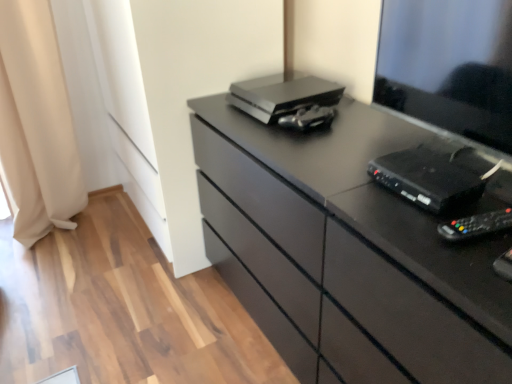
Locate an element on the screen. The height and width of the screenshot is (384, 512). vacant area that lies between satin silver printer at upper center and black plastic device at right, which is counted as the second equipment, starting from the back is located at coordinates (355, 143).